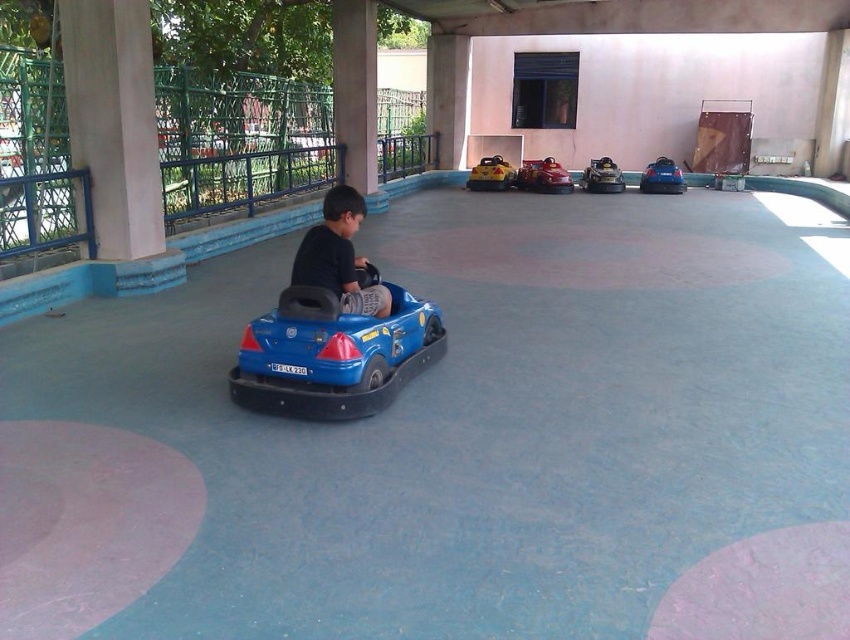
Measure the distance between shiny red bumper car at center and blue matte bumper car at center.

shiny red bumper car at center is 2.08 meters away from blue matte bumper car at center.

Which is behind, point (565, 184) or point (673, 188)?

Positioned behind is point (673, 188).

Identify the location of shiny red bumper car at center. This screenshot has height=640, width=850. (544, 176).

Image resolution: width=850 pixels, height=640 pixels. What are the coordinates of `shiny red bumper car at center` in the screenshot? It's located at (544, 176).

Is point (468, 188) positioned after point (599, 170)?

Yes, it is.

Does yellow matte toy car at center have a greater width compared to metallic silver bumper car at center?

Yes, yellow matte toy car at center is wider than metallic silver bumper car at center.

Does point (474, 164) come behind point (598, 180)?

Yes, it is behind point (598, 180).

The width and height of the screenshot is (850, 640). I want to click on yellow matte toy car at center, so click(491, 173).

Does matte black car at center have a larger size compared to blue matte bumper car at center?

No, matte black car at center is not bigger than blue matte bumper car at center.

Does point (321, 260) lie behind point (655, 170)?

No, (321, 260) is closer to viewer.

Describe the element at coordinates (340, 257) in the screenshot. I see `matte black car at center` at that location.

This screenshot has width=850, height=640. I want to click on matte black car at center, so click(340, 257).